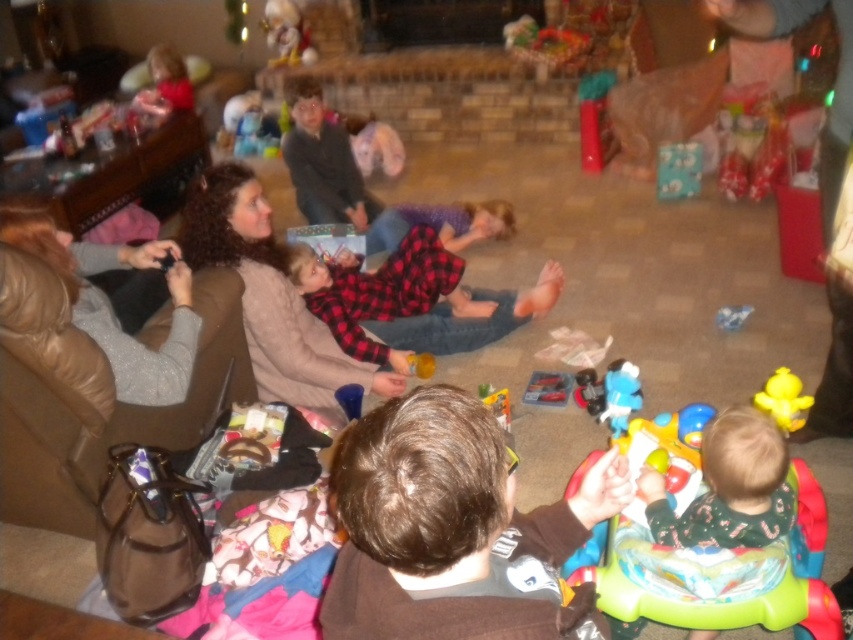
Question: Which of the following is the farthest from the observer?

Choices:
 (A) brown leather armchair at left
 (B) yellow rubber duck at lower right
 (C) fluffy white teddy bear at upper center

Answer: (C)

Question: Among these points, which one is farthest from the camera?

Choices:
 (A) (299, 390)
 (B) (282, 65)
 (C) (782, 374)
 (D) (387, 355)

Answer: (B)

Question: Which point is closer to the camera?

Choices:
 (A) (305, 307)
 (B) (242, 100)

Answer: (A)

Question: Does plush teddy bear at upper center have a larger size compared to blue plush toy at center?

Choices:
 (A) yes
 (B) no

Answer: (A)

Question: Is brown leather armchair at left above light brown sweater at center?

Choices:
 (A) yes
 (B) no

Answer: (B)

Question: Can you confirm if brown leather armchair at left is positioned to the right of plush teddy bear at upper center?

Choices:
 (A) no
 (B) yes

Answer: (B)